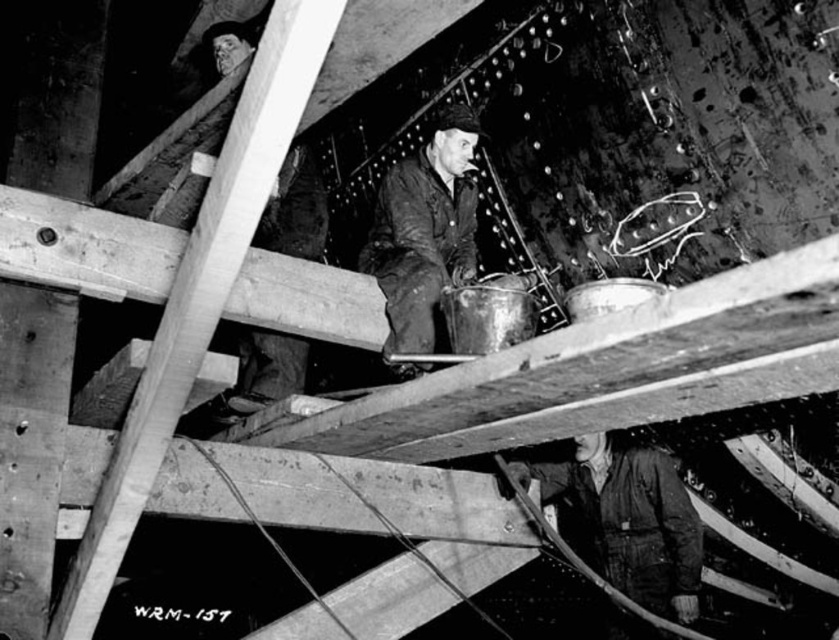
You are an inspector in a mine. You see two jackets hanging on a hook. The dark gray fabric jacket at lower right and the dark brown leather jacket at center. Which jacket is closer to you?

The dark gray fabric jacket at lower right is closer to you because it is in front of the dark brown leather jacket at center.

You are a safety inspector in this mining operation and need to ensure workers are spaced at least 5 feet apart for safety. You observe the dark gray fabric jacket at lower right and the dark brown leather jacket at center. Can both workers maintain the required safety distance?

The distance between the dark gray fabric jacket at lower right and the dark brown leather jacket at center is 4.63 feet, which is less than the required 5 feet. Therefore, the workers are not maintaining the required safety distance.